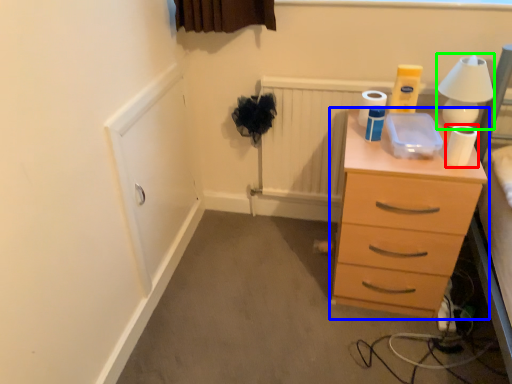
Question: Which object is positioned closest to toilet paper (highlighted by a red box)? Select from chest of drawers (highlighted by a blue box) and table lamp (highlighted by a green box).

Choices:
 (A) chest of drawers
 (B) table lamp

Answer: (B)